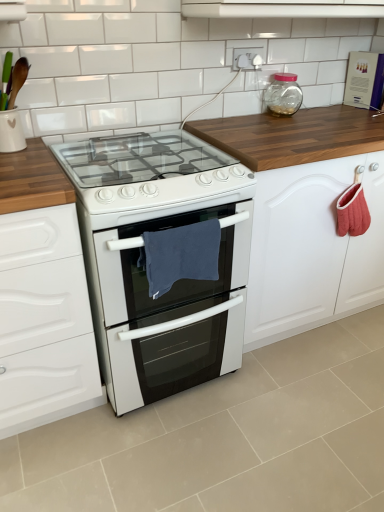
Question: Is white glossy tile at upper center spatially inside white glossy vent at upper center, or outside of it?

Choices:
 (A) outside
 (B) inside

Answer: (A)

Question: Is point (115, 96) positioned closer to the camera than point (233, 13)?

Choices:
 (A) closer
 (B) farther

Answer: (A)

Question: Considering the real-world distances, which object is farthest from the blue fabric towel at center?

Choices:
 (A) transparent glass jar at upper right
 (B) white glossy oven at center
 (C) white glossy tile at upper center
 (D) white glossy vent at upper center

Answer: (A)

Question: Which object is the farthest from the white glossy tile at upper center?

Choices:
 (A) blue fabric towel at center
 (B) white glossy oven at center
 (C) transparent glass jar at upper right
 (D) white glossy vent at upper center

Answer: (B)